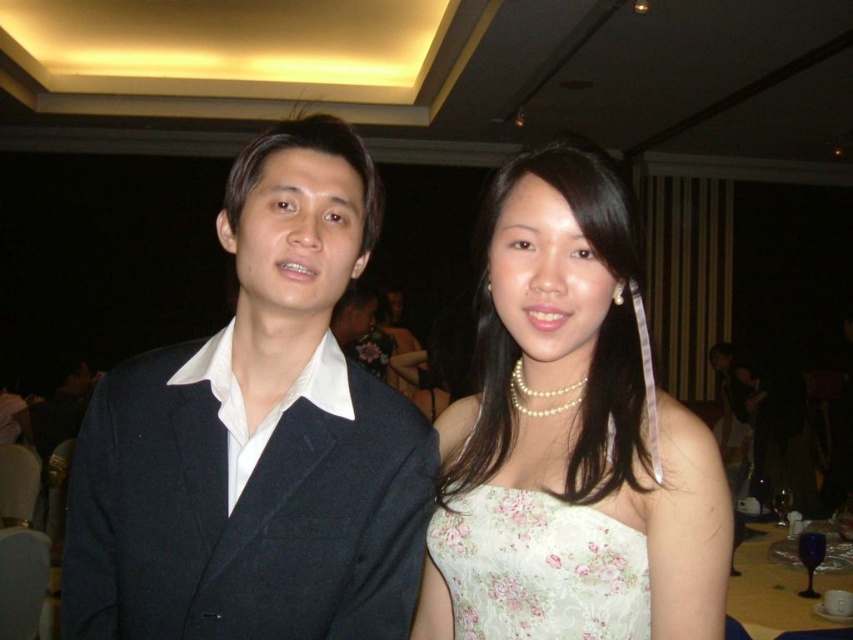
Question: Among these objects, which one is nearest to the camera?

Choices:
 (A) translucent glassware at lower right
 (B) white floral dress at center
 (C) floral satin dress at center

Answer: (B)

Question: Can you confirm if white floral dress at center is thinner than translucent glassware at lower right?

Choices:
 (A) no
 (B) yes

Answer: (B)

Question: Is matte black suit at center to the left of floral satin dress at center from the viewer's perspective?

Choices:
 (A) no
 (B) yes

Answer: (B)

Question: Which object is positioned closest to the white floral dress at center?

Choices:
 (A) translucent glassware at lower right
 (B) matte black suit at center

Answer: (B)

Question: Which object is the farthest from the translucent glassware at lower right?

Choices:
 (A) matte black suit at center
 (B) floral satin dress at center

Answer: (A)

Question: Is matte black suit at center positioned at the back of floral satin dress at center?

Choices:
 (A) no
 (B) yes

Answer: (A)